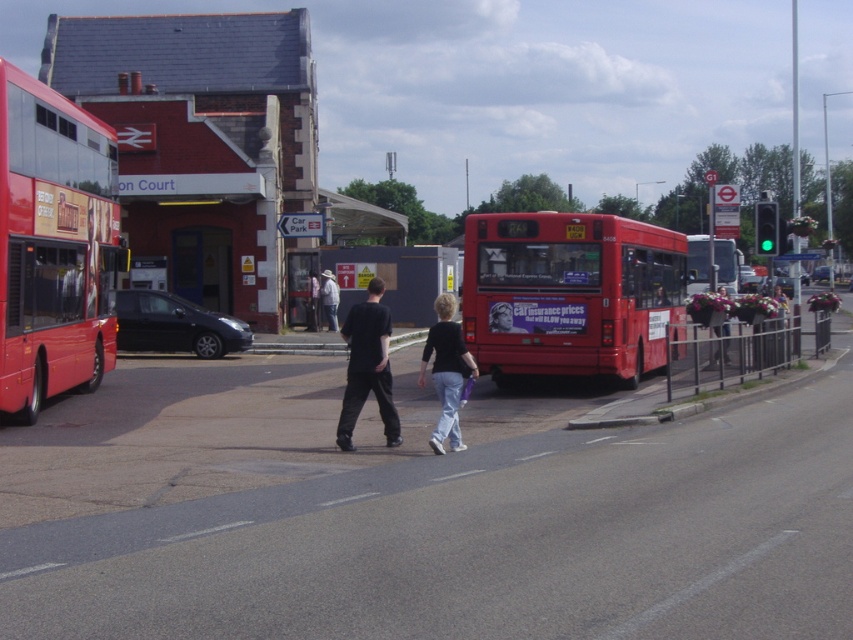
Question: Which object appears closest to the camera in this image?

Choices:
 (A) denim jacket at center
 (B) light blue jeans at center

Answer: (B)

Question: Is shiny red bus at left positioned before light gray fabric jacket at center?

Choices:
 (A) yes
 (B) no

Answer: (A)

Question: Which of the following is the farthest from the observer?

Choices:
 (A) matte black jacket at center
 (B) black cotton pants at center
 (C) shiny red bus at left

Answer: (A)

Question: Estimate the real-world distances between objects in this image. Which object is farther from the dark gray pants at center?

Choices:
 (A) light blue jeans at center
 (B) denim jacket at center
 (C) matte red bus at center
 (D) light gray fabric jacket at center

Answer: (A)

Question: Can you confirm if matte red bus at center is positioned to the right of denim jacket at center?

Choices:
 (A) no
 (B) yes

Answer: (A)

Question: Can you confirm if black cotton pants at center is thinner than denim jacket at center?

Choices:
 (A) yes
 (B) no

Answer: (A)